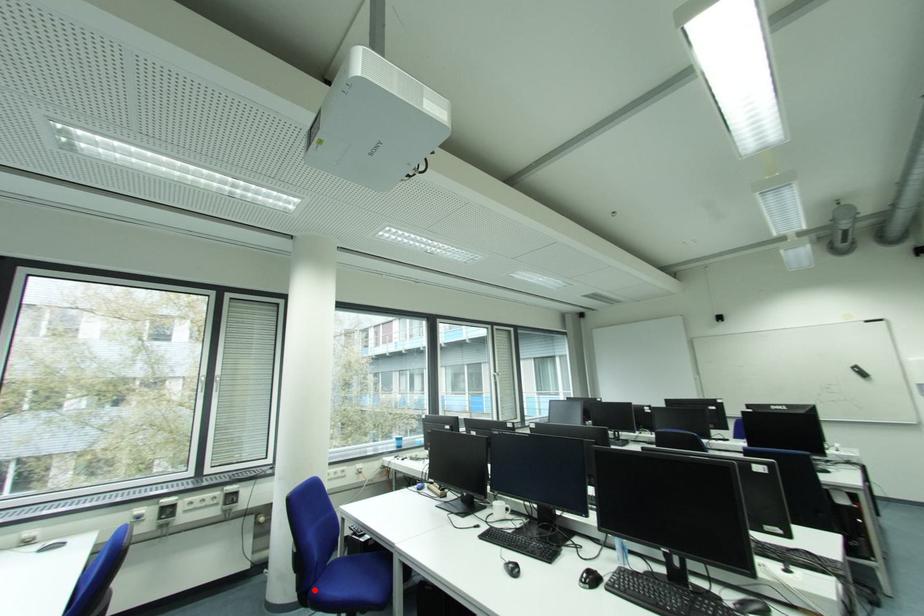
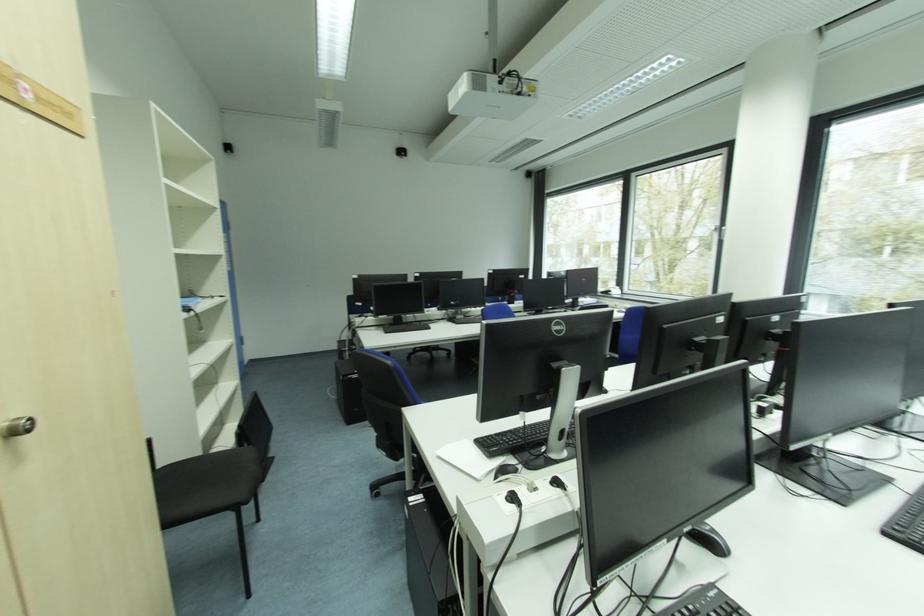
Question: I am providing you with two images of the same scene from different viewpoints. A red point is marked on the first image. Can you still see the location of the red point in image 2?

Choices:
 (A) Yes
 (B) No

Answer: (B)